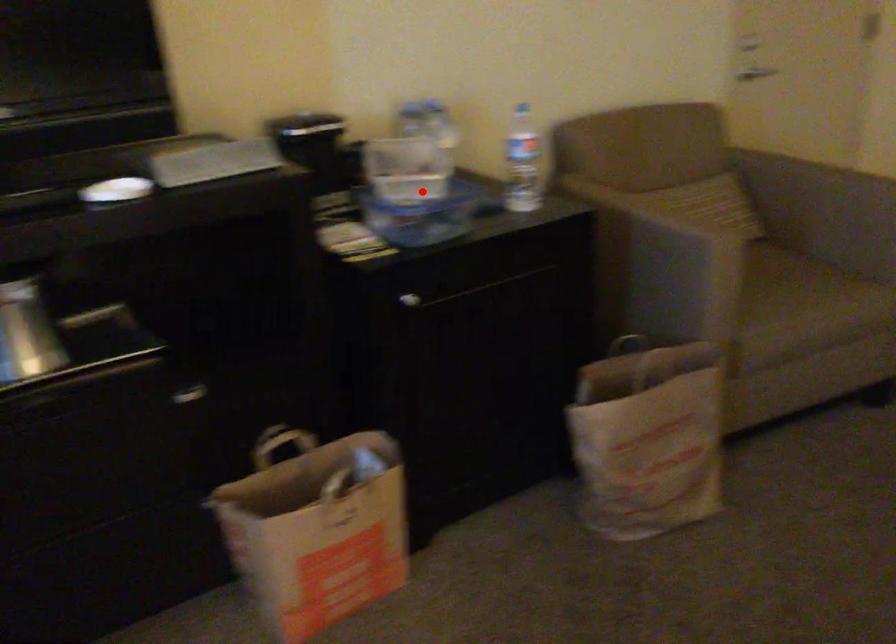
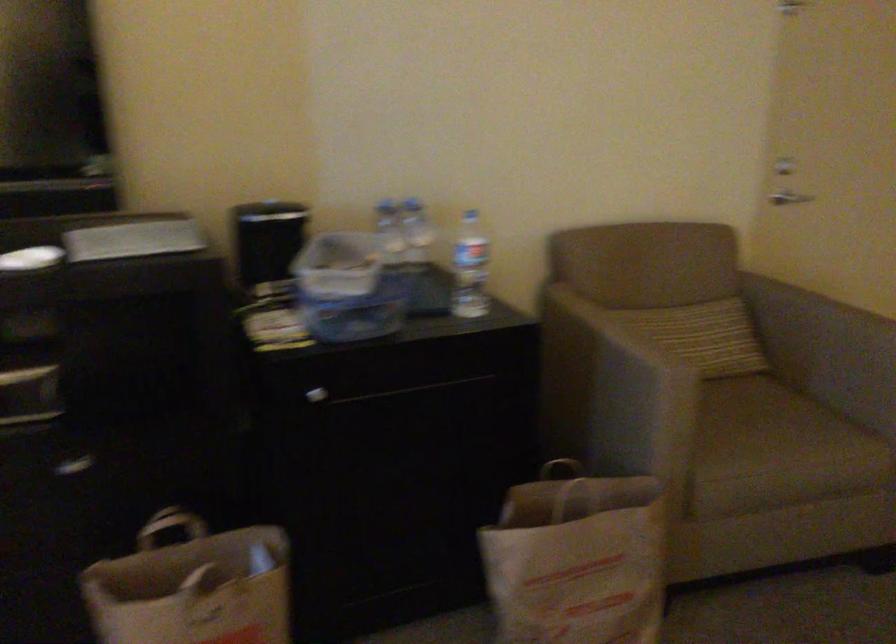
Locate, in the second image, the point that corresponds to the highlighted location in the first image.

(348, 288)